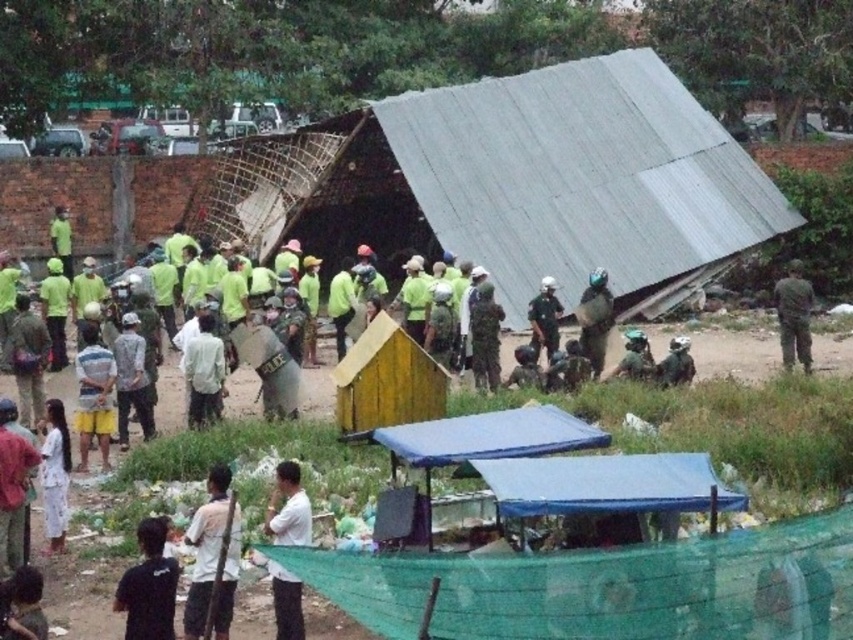
You are a photographer at the scene and want to capture a clear photo of both the white matte shirt at lower center and the white cotton dress at lower left. Since you want both to be visible, which clothing item should you focus on first to ensure it doesn

The white matte shirt at lower center is bigger than the white cotton dress at lower left, so you should focus on capturing the white matte shirt at lower center first since it is larger and will be more prominent in the frame.

You are a photographer at the scene and want to capture a photo that includes both the white matte shirt at lower center and the white matte shirt at center. Which shirt should you focus on first to ensure both are in frame?

You should focus on the white matte shirt at lower center first because it is taller than the white matte shirt at center, so adjusting the camera angle to include its height will naturally include the shorter one as well.